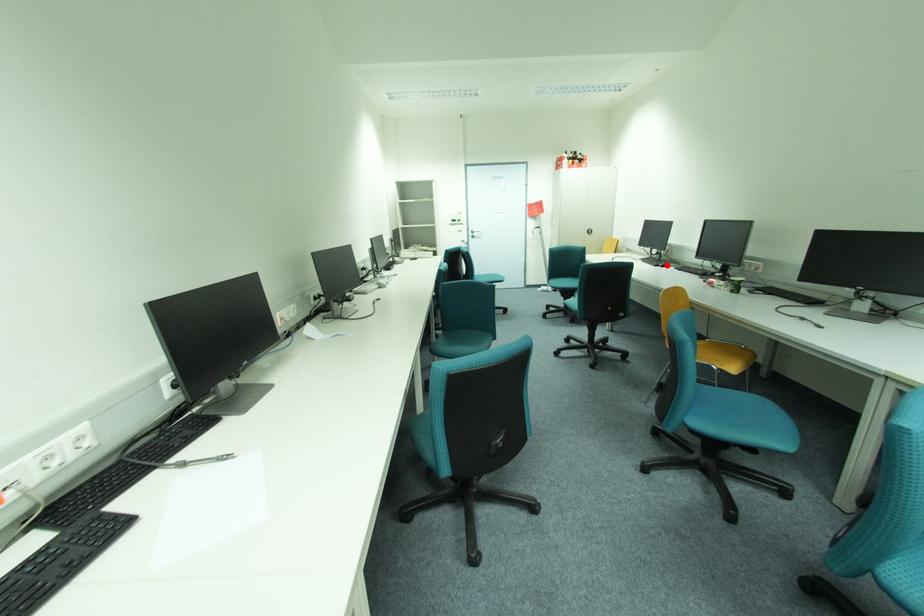
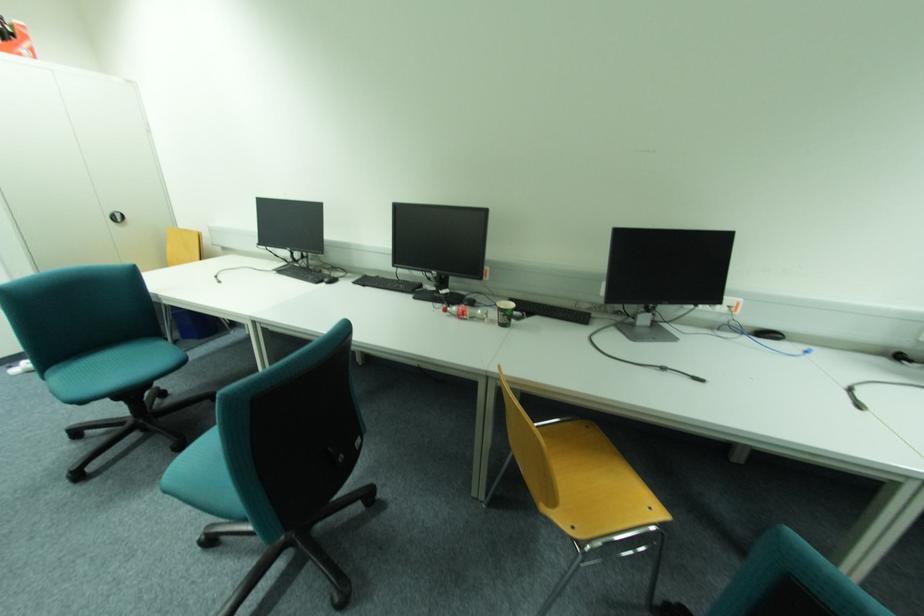
Find the pixel in the second image that matches the highlighted location in the first image.

(333, 280)